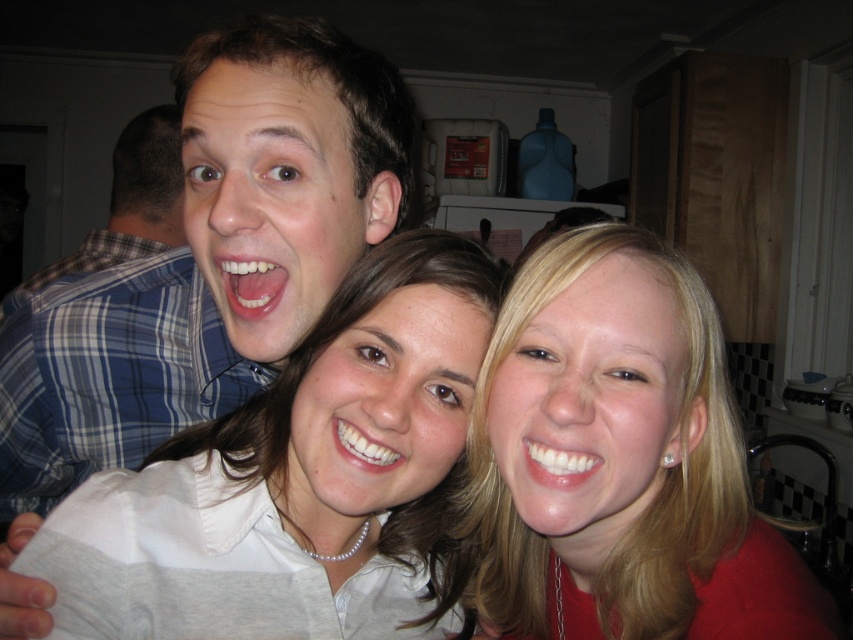
Is blonde hair at center closer to the viewer compared to white matte shirt at upper left?

Yes, blonde hair at center is in front of white matte shirt at upper left.

Is blonde hair at center positioned at the back of white matte shirt at upper left?

No.

Who is more distant from viewer, (637, 506) or (276, 340)?

The point (276, 340) is behind.

At what (x,y) coordinates should I click in order to perform the action: click on blonde hair at center. Please return your answer as a coordinate pair (x, y). This screenshot has width=853, height=640. Looking at the image, I should click on (619, 460).

Between point (302, 454) and point (115, 160), which one is positioned behind?

Point (115, 160)

At what (x,y) coordinates should I click in order to perform the action: click on white pearl necklace at center. Please return your answer as a coordinate pair (x, y). This screenshot has height=640, width=853. Looking at the image, I should click on (370, 412).

Is point (204, 81) closer to camera compared to point (0, 316)?

Yes, point (204, 81) is in front of point (0, 316).

Who is higher up, white matte shirt at upper left or blue plaid shirt at left?

blue plaid shirt at left is higher up.

Who is more distant from viewer, (x=392, y=173) or (x=157, y=246)?

Point (x=157, y=246)

Locate an element on the screen. The height and width of the screenshot is (640, 853). white matte shirt at upper left is located at coordinates (212, 257).